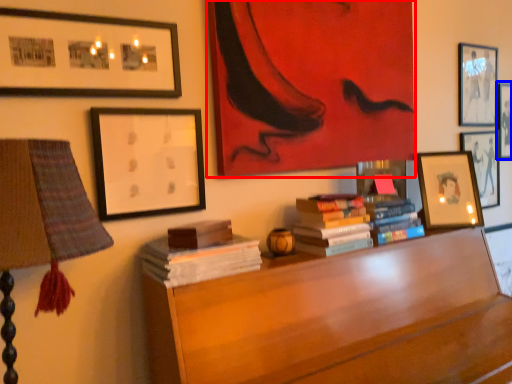
Question: Which object appears farthest to the camera in this image, picture frame (highlighted by a red box) or picture frame (highlighted by a blue box)?

Choices:
 (A) picture frame
 (B) picture frame

Answer: (B)